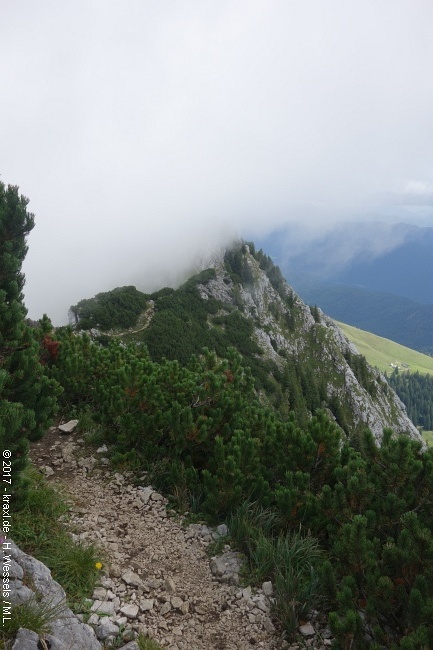
You are a GUI agent. You are given a task and a screenshot of the screen. Output one action in this format:
    pyautogui.click(x=<x>, y=<y>)
    Task: Click on the green cactus
    The image size is (433, 650).
    Given the screenshot: What is the action you would take?
    pyautogui.click(x=95, y=368), pyautogui.click(x=13, y=298), pyautogui.click(x=193, y=408), pyautogui.click(x=291, y=465), pyautogui.click(x=377, y=502)